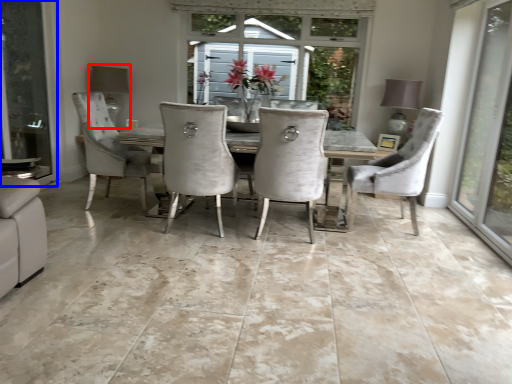
Question: Among these objects, which one is farthest to the camera, lamp (highlighted by a red box) or screen door (highlighted by a blue box)?

Choices:
 (A) lamp
 (B) screen door

Answer: (A)